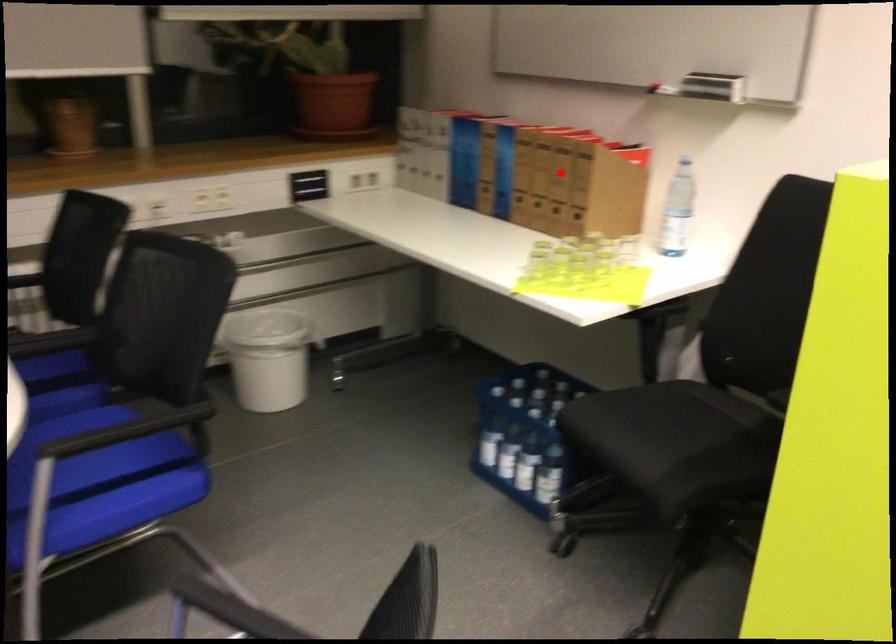
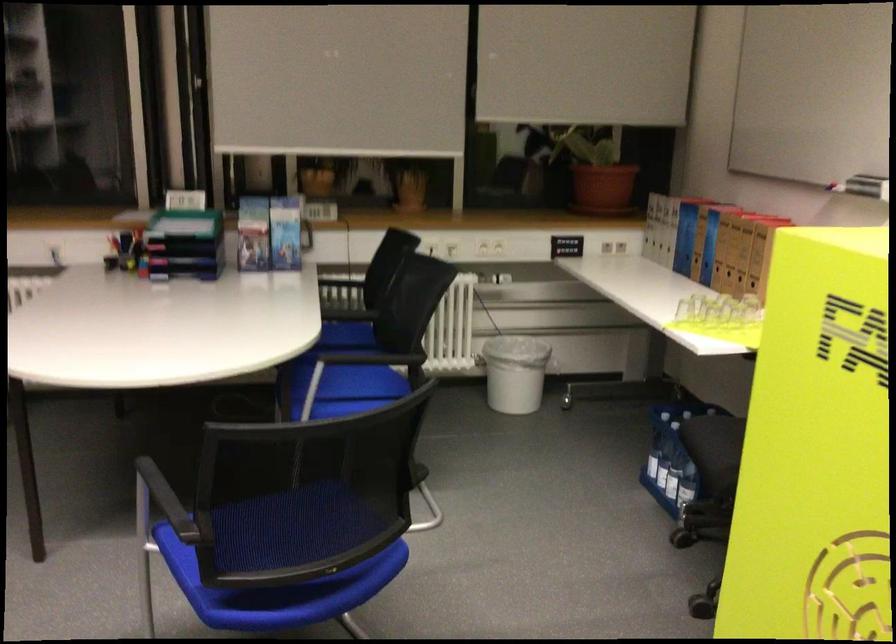
Question: I am providing you with two images of the same scene from different viewpoints. Image1 has a red point marked. In image2, the corresponding 3D location appears at what relative position? Reply with the corresponding letter.

Choices:
 (A) Closer
 (B) Farther

Answer: (B)